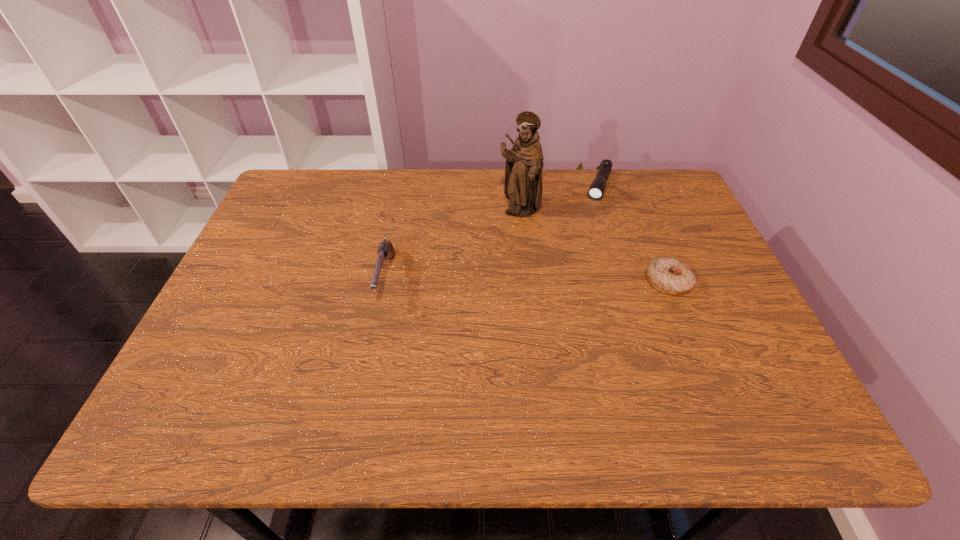
The width and height of the screenshot is (960, 540). What are the coordinates of `the leftmost object` in the screenshot? It's located at (386, 250).

At what (x,y) coordinates should I click in order to perform the action: click on the third shortest object. Please return your answer as a coordinate pair (x, y). Image resolution: width=960 pixels, height=540 pixels. Looking at the image, I should click on (386, 250).

Image resolution: width=960 pixels, height=540 pixels. What are the coordinates of `doughnut` in the screenshot? It's located at (671, 276).

Where is `the second object from left to right`? This screenshot has width=960, height=540. the second object from left to right is located at coordinates (523, 186).

Identify the location of figurine. (523, 186).

Locate an element on the screen. The image size is (960, 540). flashlight is located at coordinates click(x=596, y=190).

Locate an element on the screen. free region located 0.050m aiming along the barrel of the second tallest object is located at coordinates (376, 329).

Identify the location of vacant point located 0.140m on the back of the doughnut. (647, 232).

Where is `vacant space located 0.070m on the front-facing side of the second object from left to right`? This screenshot has width=960, height=540. vacant space located 0.070m on the front-facing side of the second object from left to right is located at coordinates (521, 241).

What are the coordinates of `vacant space located on the front-facing side of the second object from left to right` in the screenshot? It's located at (527, 305).